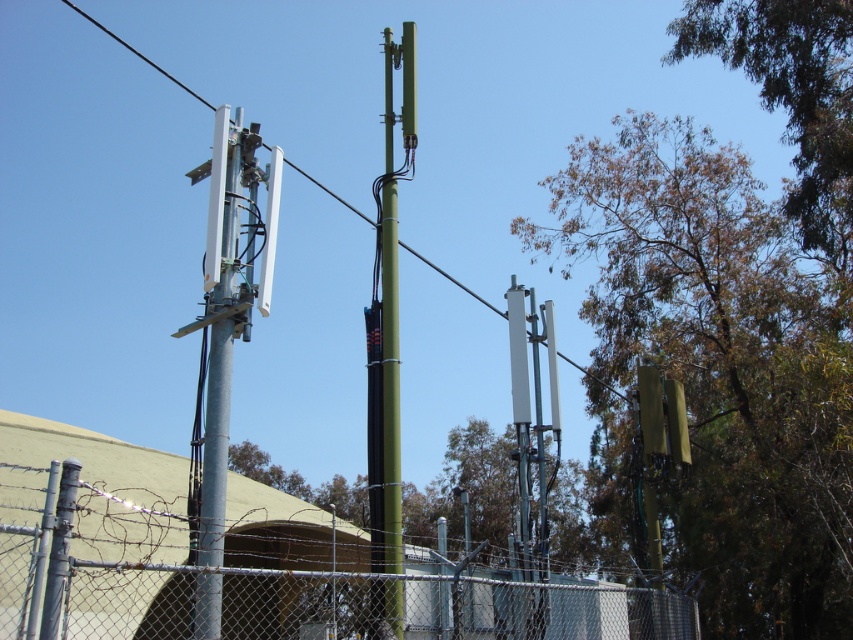
Based on the photo, you are standing at point (444, 605) in the telecommunications setup. What object are you currently standing on?

You are standing on the metal chainlink fence at lower center located at point (444, 605).

You are standing in front of the telecommunications setup and want to determine which of the two points, point (381, 426) or point (564, 356), is nearer to you. Based on the image, which point is closer?

Point (381, 426) is closer to the camera than point (564, 356), so it is the nearer one.